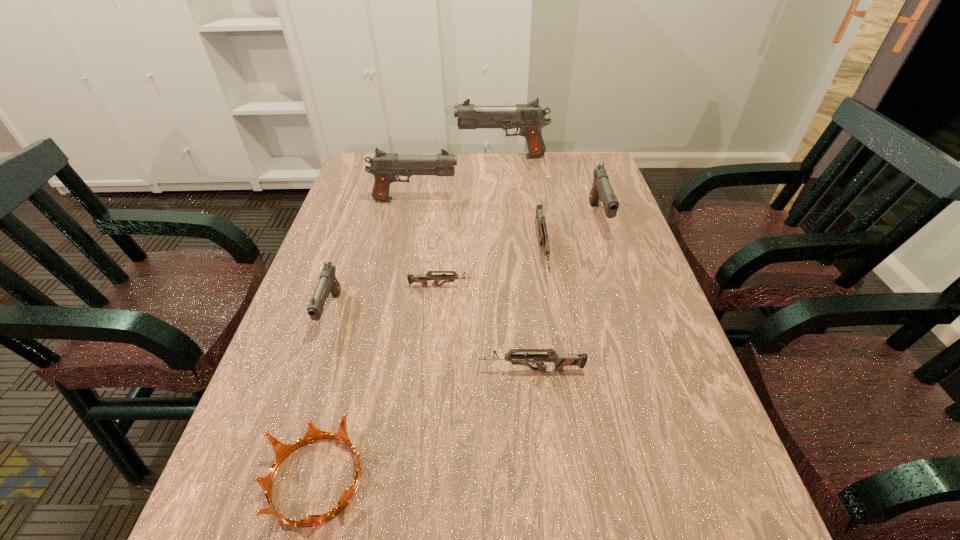
Identify the location of object that is at the right edge. (601, 189).

Locate an element on the screen. object that is at the near left corner is located at coordinates (281, 450).

Where is `vacant space at the far edge`? vacant space at the far edge is located at coordinates (486, 160).

Find the location of a particular element. This screenshot has width=960, height=540. vacant area at the left edge of the desktop is located at coordinates (367, 208).

Identify the location of free region at the right edge. The image size is (960, 540). (583, 202).

Where is `vacant area between the smallest gray gun and the leftmost grey gun`? The image size is (960, 540). vacant area between the smallest gray gun and the leftmost grey gun is located at coordinates (386, 299).

The image size is (960, 540). I want to click on unoccupied position between the third tallest object and the sixth shortest gun, so click(x=507, y=209).

Find the location of a particular element. unoccupied position between the sixth tallest gun and the nearest gray gun is located at coordinates (431, 341).

You are a GUI agent. You are given a task and a screenshot of the screen. Output one action in this format:
    pyautogui.click(x=<x>, y=<y>)
    Task: Click on the unoccupied position between the nearest gray gun and the second tallest gun
    
    Given the screenshot: What is the action you would take?
    pyautogui.click(x=372, y=256)

I want to click on free space between the third smallest gray gun and the sixth shortest object, so (x=507, y=209).